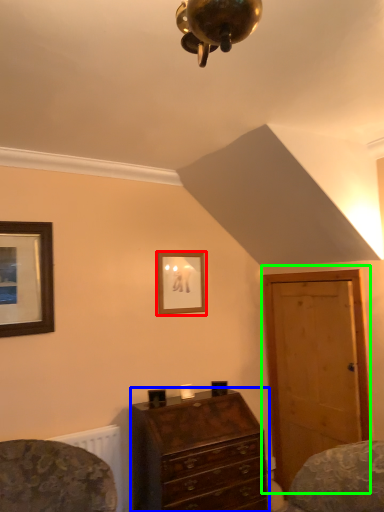
Question: Based on their relative distances, which object is farther from picture frame (highlighted by a red box)? Choose from chest of drawers (highlighted by a blue box) and door (highlighted by a green box).

Choices:
 (A) chest of drawers
 (B) door

Answer: (A)